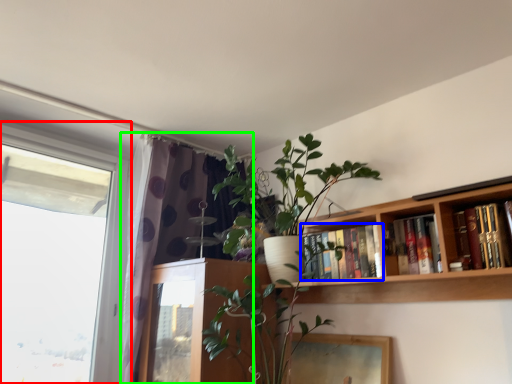
Question: Considering the real-world distances, which object is closest to window (highlighted by a red box)? book (highlighted by a blue box) or curtain (highlighted by a green box).

Choices:
 (A) book
 (B) curtain

Answer: (B)